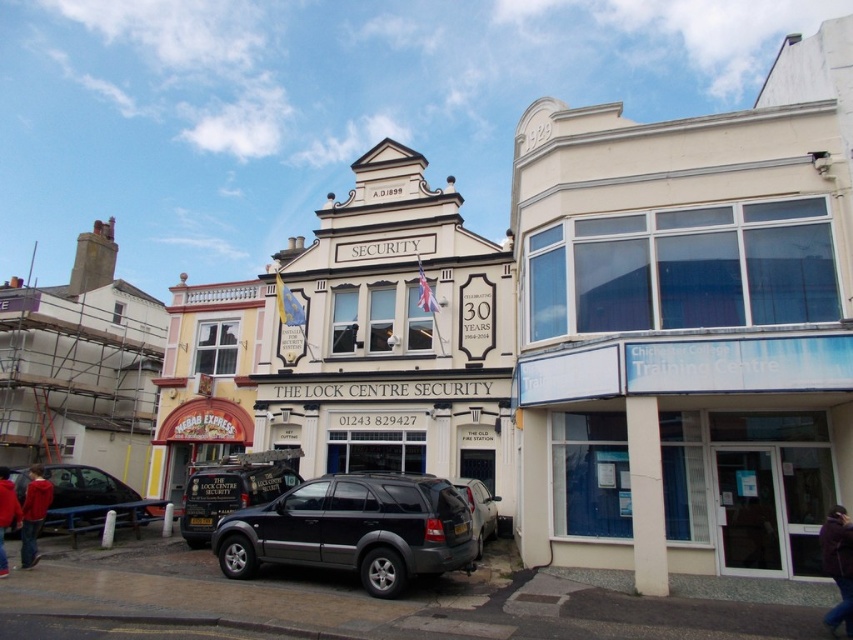
You are standing at the point with coordinates (x=352, y=529) in the image. What object are you standing on?

You are standing on the black matte suv at center.

Looking at this image, you are a pedestrian standing on the street in front of THE LOCK CENTRE SECURITY. You see a shiny black car at lower left and a red fleece jacket at lower left. Which object is bigger?

The shiny black car at lower left is larger in size than the red fleece jacket at lower left.

You are a delivery driver who needs to park your van, which is 6 meters long, between the shiny black car at lower left and the camera. Can you fit your van there without overlapping either object?

The distance between the shiny black car at lower left and the camera is 25.15 meters. Since your van is 6 meters long, there is sufficient space to park between them without overlapping either object.